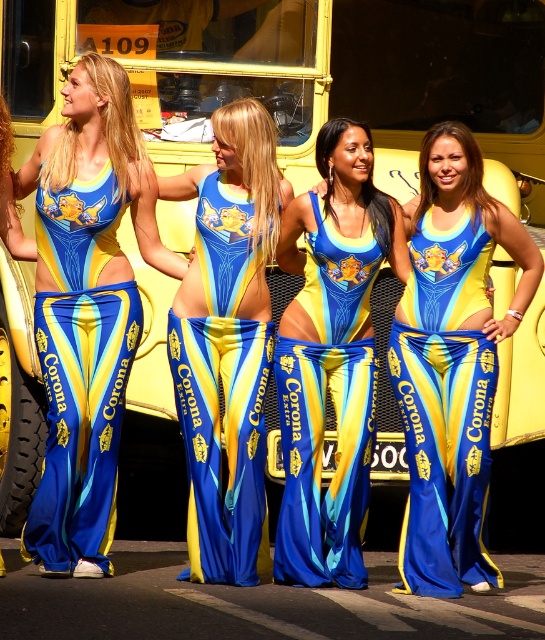
Question: Among these objects, which one is nearest to the camera?

Choices:
 (A) shiny blue fabric dress at center
 (B) matte blue fabric bikini at center
 (C) matte blue fabric bikini at left
 (D) shiny blue fabric bikini at center

Answer: (D)

Question: Is shiny blue fabric bikini at center closer to camera compared to matte blue fabric bikini at center?

Choices:
 (A) no
 (B) yes

Answer: (B)

Question: Which point is farther to the camera?

Choices:
 (A) (222, 378)
 (B) (425, 176)
 (C) (116, 390)

Answer: (B)

Question: Which point is farther to the camera?

Choices:
 (A) (13, 192)
 (B) (239, 301)
 (C) (473, 465)

Answer: (A)

Question: Can you confirm if shiny blue fabric bikini at center is positioned above blue satin pants at center?

Choices:
 (A) yes
 (B) no

Answer: (B)

Question: Is matte blue fabric bikini at left above blue satin pants at center?

Choices:
 (A) yes
 (B) no

Answer: (B)